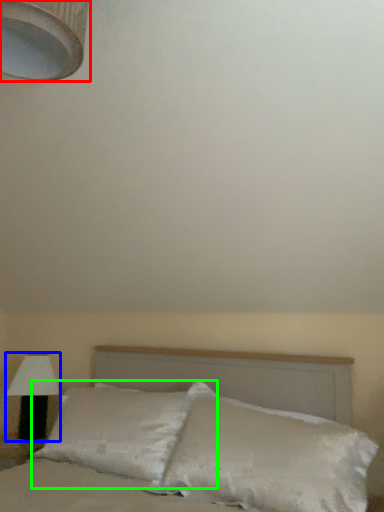
Question: Estimate the real-world distances between objects in this image. Which object is closer to lamp (highlighted by a red box), lamp (highlighted by a blue box) or pillow (highlighted by a green box)?

Choices:
 (A) lamp
 (B) pillow

Answer: (B)